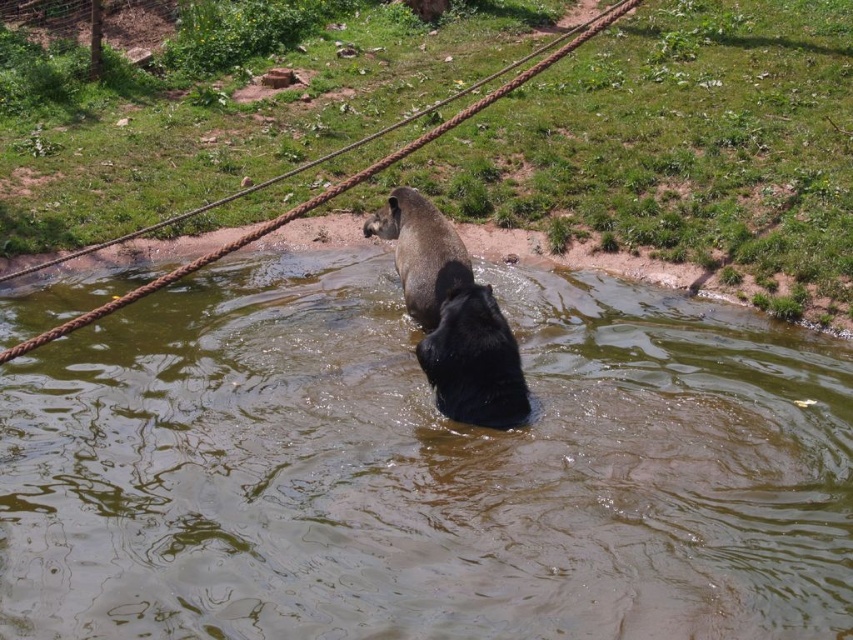
Is brown murky water at center wider than brown fur dog at center?

In fact, brown murky water at center might be narrower than brown fur dog at center.

Can you confirm if brown murky water at center is positioned above brown fur dog at center?

Incorrect, brown murky water at center is not positioned above brown fur dog at center.

Does point (134, 464) come in front of point (421, 205)?

Yes, point (134, 464) is closer to viewer.

Locate an element on the screen. The width and height of the screenshot is (853, 640). brown murky water at center is located at coordinates (422, 468).